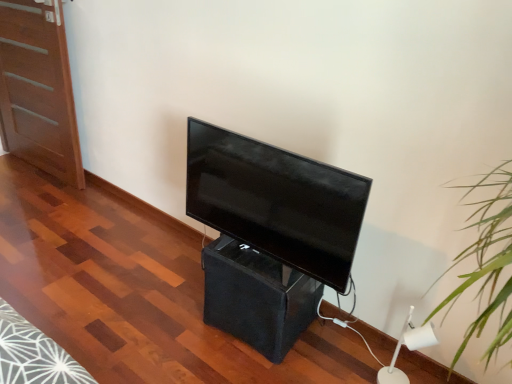
Identify the location of free space behind white plastic lamp at lower right. The width and height of the screenshot is (512, 384). (376, 345).